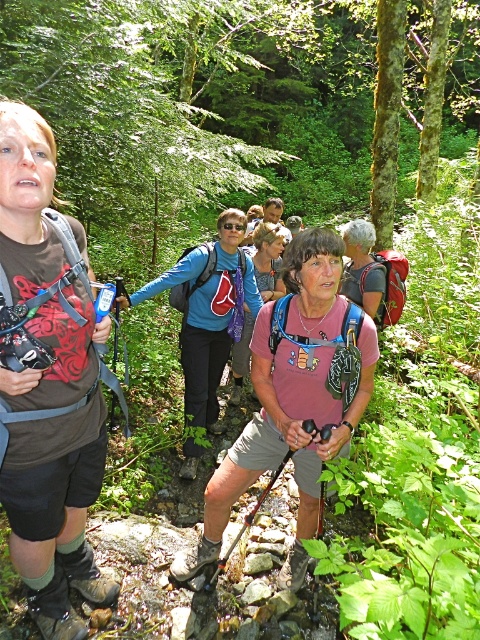
You are a hiker in the forest scene described. You notice a specific point at coordinates (290, 400). What object is this point located on?

The point at coordinates (290, 400) is located on the pink fabric shirt at center.

You are a photographer trying to capture the hikers in the forest. You notice the pink fabric shirt at center and the blue fabric backpack at center. Which object should you focus on if you want to photograph something that takes up more visual space in the frame?

The blue fabric backpack at center takes up more visual space than the pink fabric shirt at center, so focusing on the blue fabric backpack at center would be better if you want to photograph something that takes up more visual space in the frame.